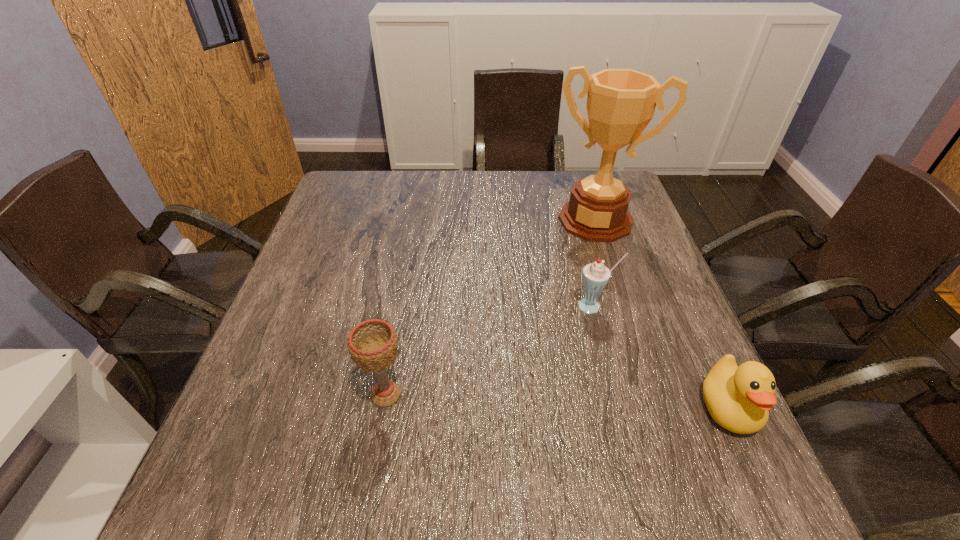
Identify the location of the leftmost object. (372, 344).

You are a GUI agent. You are given a task and a screenshot of the screen. Output one action in this format:
    pyautogui.click(x=<x>, y=<y>)
    Task: Click on the duck
    This screenshot has height=540, width=960.
    Given the screenshot: What is the action you would take?
    pyautogui.click(x=738, y=398)

Locate an element on the screen. milkshake is located at coordinates (595, 276).

Where is `the tallest object`? the tallest object is located at coordinates (621, 102).

Image resolution: width=960 pixels, height=540 pixels. I want to click on the farthest object, so click(621, 102).

Identify the location of vacant space located on the left of the leftmost object. (287, 395).

Identify the location of free space located 0.280m on the straw side of the second farthest object. This screenshot has width=960, height=540. (547, 415).

The image size is (960, 540). Find the location of `free space located on the straw side of the second farthest object`. free space located on the straw side of the second farthest object is located at coordinates (543, 424).

Locate an element on the screen. This screenshot has height=540, width=960. vacant position located on the straw side of the second farthest object is located at coordinates (550, 407).

Identify the location of free space located on the front-facing side of the award. (543, 335).